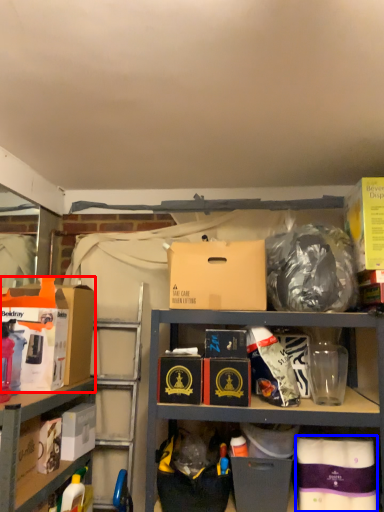
Question: Which point is closer to the camera, box (highlighted by a red box) or box (highlighted by a blue box)?

Choices:
 (A) box
 (B) box

Answer: (B)